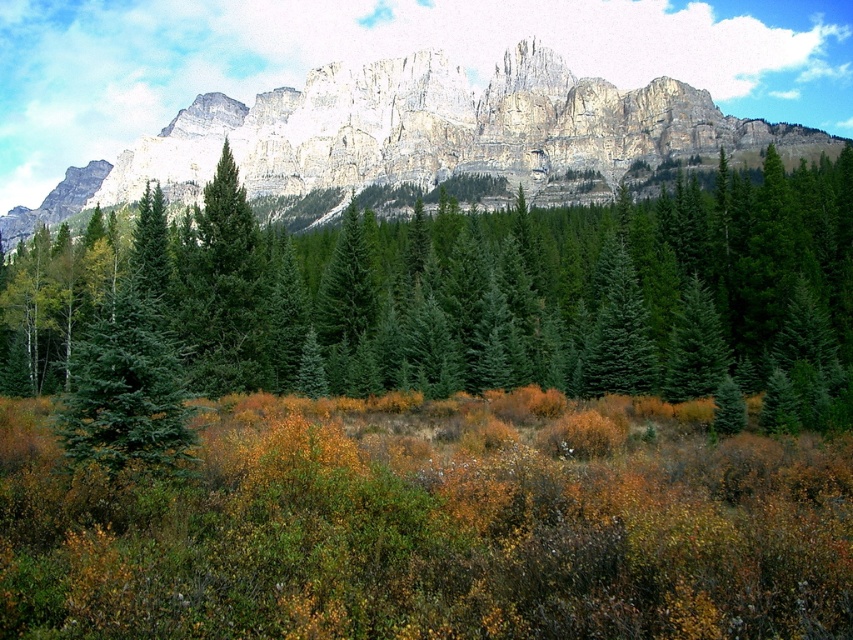
Question: Which object is positioned farthest from the green matte evergreen tree at left?

Choices:
 (A) rugged stone mountain at upper center
 (B) green matte evergreen tree at center

Answer: (A)

Question: In this image, where is green matte evergreen tree at center located relative to green matte evergreen tree at left?

Choices:
 (A) below
 (B) above

Answer: (B)

Question: Which object is the closest to the rugged stone mountain at upper center?

Choices:
 (A) green matte evergreen tree at center
 (B) green matte evergreen tree at left

Answer: (A)

Question: Can you confirm if green matte evergreen tree at center is positioned to the right of green matte evergreen tree at left?

Choices:
 (A) yes
 (B) no

Answer: (A)

Question: Can you confirm if rugged stone mountain at upper center is positioned above green matte evergreen tree at left?

Choices:
 (A) no
 (B) yes

Answer: (B)

Question: Which object is the closest to the rugged stone mountain at upper center?

Choices:
 (A) green matte evergreen tree at left
 (B) green matte evergreen tree at center

Answer: (B)